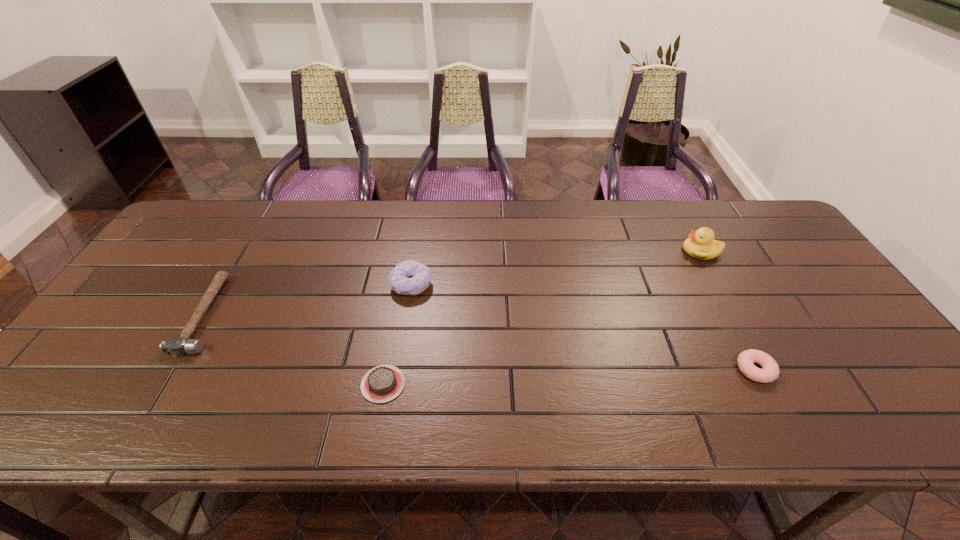
Where is `vacant space at the right edge of the desktop`? The height and width of the screenshot is (540, 960). vacant space at the right edge of the desktop is located at coordinates (798, 267).

In the image, there is a desktop. At what (x,y) coordinates should I click in order to perform the action: click on vacant space at the far left corner. Please return your answer as a coordinate pair (x, y). Looking at the image, I should click on (221, 210).

The width and height of the screenshot is (960, 540). In order to click on vacant region at the near left corner of the desktop in this screenshot , I will do `click(99, 412)`.

Find the location of a particular element. unoccupied position between the chocolate cake and the farther doughnut is located at coordinates (397, 334).

I want to click on unoccupied position between the farthest object and the chocolate cake, so click(x=542, y=318).

Find the location of a particular element. free spot between the tallest object and the left doughnut is located at coordinates (556, 268).

Find the location of a particular element. vacant space that is in between the second tallest object and the hammer is located at coordinates (308, 299).

I want to click on free spot between the nearer doughnut and the hammer, so click(x=480, y=342).

Locate an element on the screen. The height and width of the screenshot is (540, 960). free spot between the right doughnut and the farthest object is located at coordinates (728, 310).

This screenshot has height=540, width=960. What are the coordinates of `vacant space that's between the shorter doughnut and the leftmost object` in the screenshot? It's located at (480, 342).